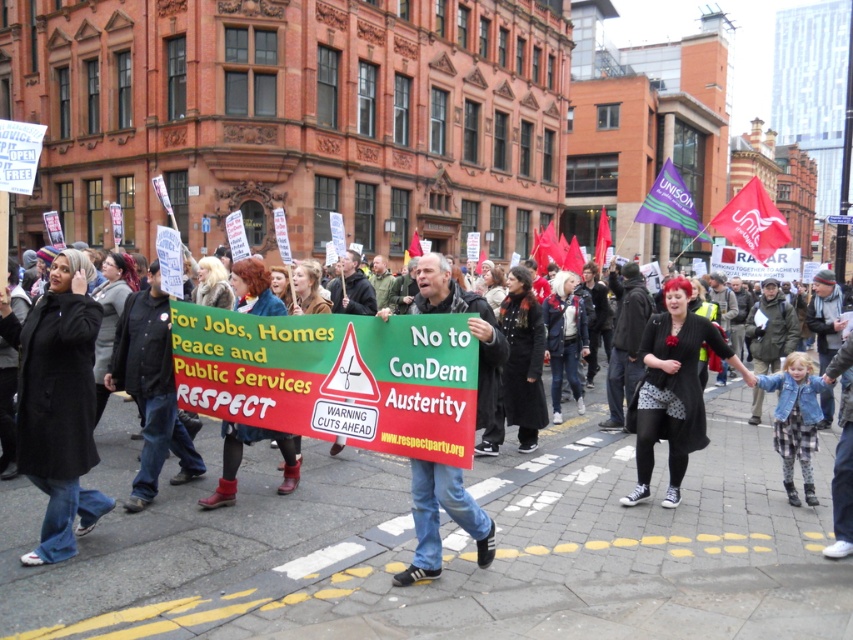
What is the 2D coordinate of the jeans at center?

The jeans at center is located at point (271,452).

You are a photographer standing at the center of the protest march. You want to take a photo of the black wool coat at left. Where should you position yourself to capture the coat in the frame?

The black wool coat at left is located at point (x=61, y=404), so you should position yourself to the left side of the scene to capture it in the frame.

You are a photographer at the protest march. You want to take a photo of the jeans at center and the black textured coat at center. Which object should you focus on first if you want to capture both in the frame without moving the camera?

You should focus on the black textured coat at center first because it occupies more space than the jeans at center, ensuring it fits well in the frame.